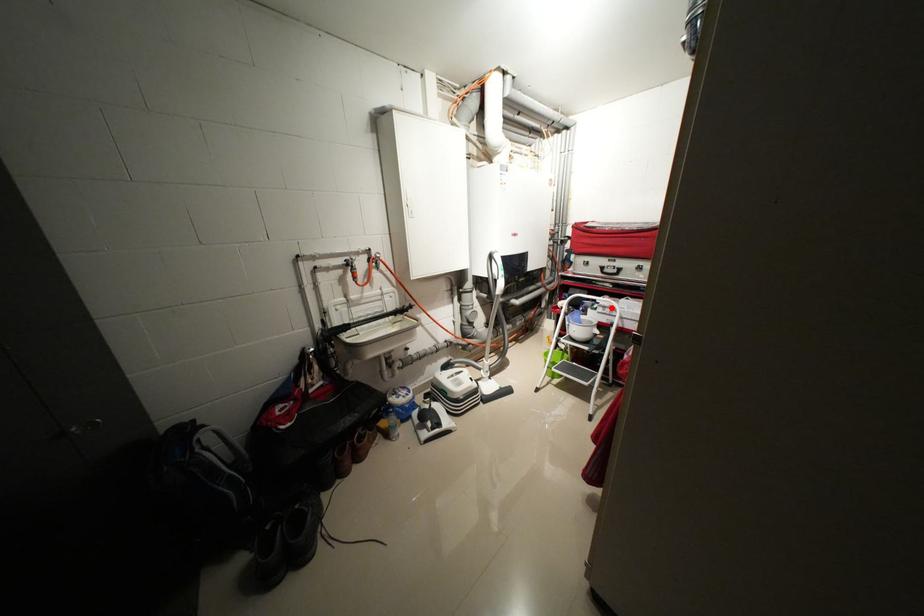
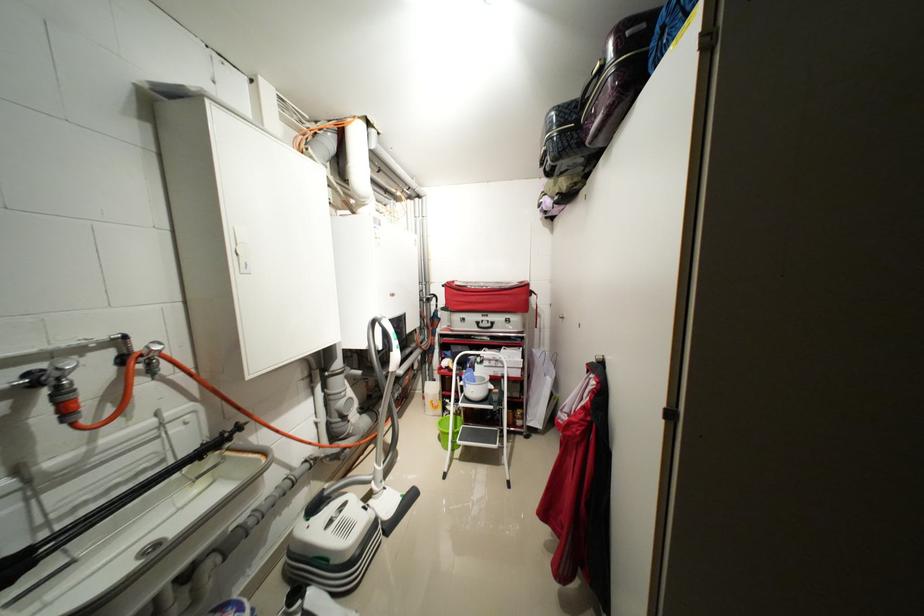
Question: I am providing you with two images of the same scene from different viewpoints. A red point is marked on the first image. At the location where the point appears in image 1, is it still visible in image 2?

Choices:
 (A) Yes
 (B) No

Answer: (A)